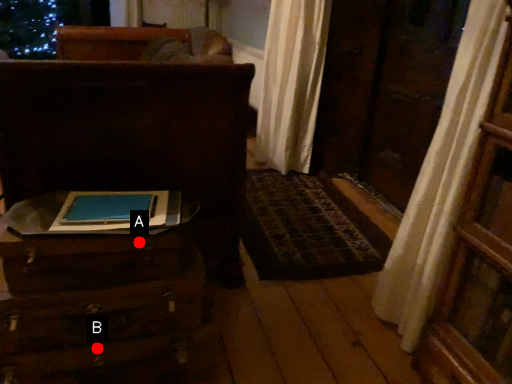
Question: Two points are circled on the image, labeled by A and B beside each circle. Which point appears closest to the camera in this image?

Choices:
 (A) A is closer
 (B) B is closer

Answer: (A)